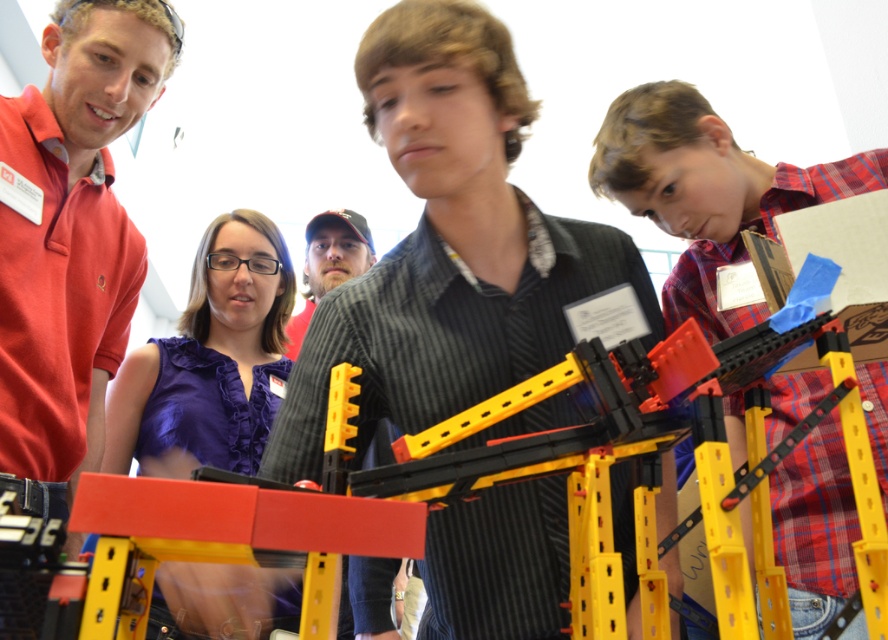
Who is positioned more to the right, matte black shirt at center or purple fabric shirt at center?

matte black shirt at center

Is point (427, 620) closer to camera compared to point (205, 371)?

Yes, point (427, 620) is in front of point (205, 371).

Image resolution: width=888 pixels, height=640 pixels. I want to click on matte black shirt at center, so [448, 243].

This screenshot has width=888, height=640. In order to click on matte black shirt at center in this screenshot , I will do `click(448, 243)`.

Who is taller, matte black shirt at center or matte red shirt at left?

matte red shirt at left

Can you confirm if matte black shirt at center is taller than matte red shirt at left?

Incorrect, matte black shirt at center's height is not larger of matte red shirt at left's.

Between point (502, 88) and point (36, 259), which one is positioned in front?

Positioned in front is point (502, 88).

Locate an element on the screen. The image size is (888, 640). matte black shirt at center is located at coordinates (448, 243).

Can you confirm if matte red shirt at left is positioned above matte black cap at center?

Yes, matte red shirt at left is above matte black cap at center.

From the picture: Is matte red shirt at left further to the viewer compared to matte black cap at center?

No, it is in front of matte black cap at center.

Between point (45, 394) and point (354, 234), which one is positioned behind?

The point (354, 234) is behind.

Identify the location of matte red shirt at left. (70, 230).